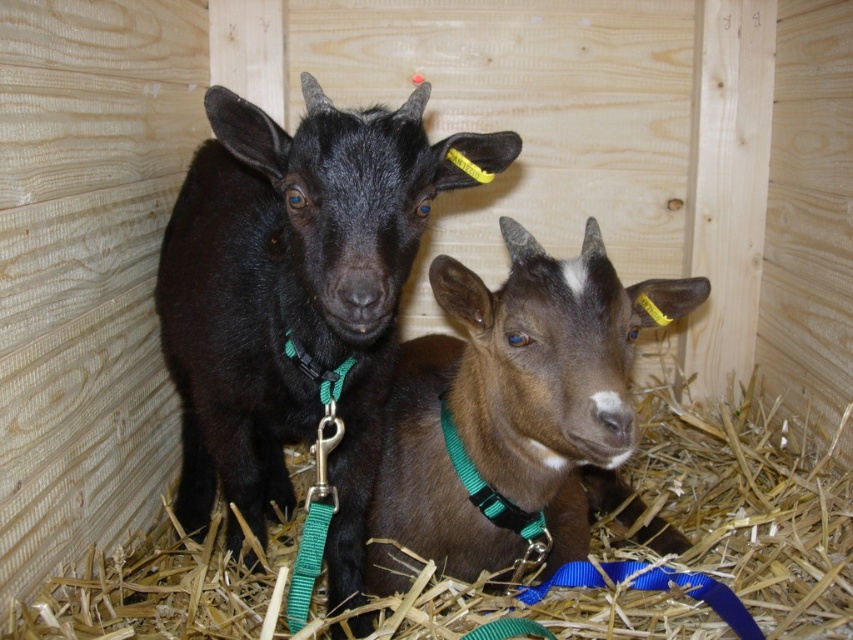
Question: Which point is closer to the camera?

Choices:
 (A) green nylon collar at center
 (B) brown matte goat at center
 (C) black matte goat at center

Answer: (C)

Question: Considering the real-world distances, which object is closest to the green nylon collar at center?

Choices:
 (A) brown matte goat at center
 (B) black matte goat at center

Answer: (A)

Question: Which of the following is the farthest from the observer?

Choices:
 (A) (198, 308)
 (B) (415, 481)
 (C) (490, 611)

Answer: (B)

Question: Is brown straw at center positioned at the back of green nylon collar at center?

Choices:
 (A) yes
 (B) no

Answer: (B)

Question: Observing the image, what is the correct spatial positioning of black matte goat at center in reference to brown straw at center?

Choices:
 (A) left
 (B) right

Answer: (A)

Question: Is brown matte goat at center positioned before brown straw at center?

Choices:
 (A) no
 (B) yes

Answer: (B)